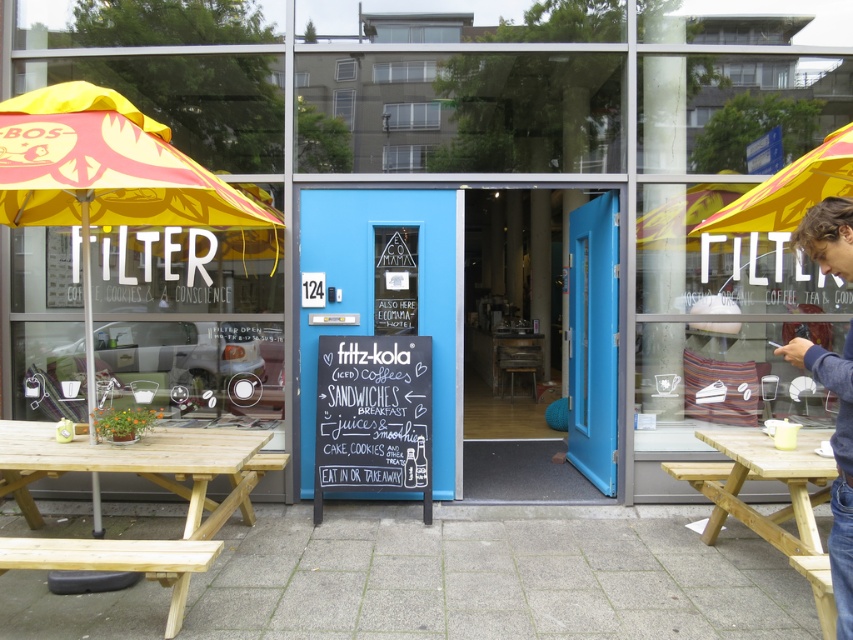
Question: Does yellow fabric umbrella at left come in front of natural wood picnic table at lower left?

Choices:
 (A) no
 (B) yes

Answer: (A)

Question: Among these objects, which one is farthest from the camera?

Choices:
 (A) black chalkboard sign at center
 (B) natural wood picnic table at right

Answer: (A)

Question: Which of the following is the farthest from the observer?

Choices:
 (A) black chalkboard sign at center
 (B) natural wood picnic table at right
 (C) yellow fabric umbrella at left
 (D) brown hair at right

Answer: (A)

Question: Which point is farther to the camera?

Choices:
 (A) (158, 195)
 (B) (834, 353)

Answer: (A)

Question: Is natural wood picnic table at right thinner than brown hair at right?

Choices:
 (A) no
 (B) yes

Answer: (A)

Question: Does natural wood picnic table at right appear on the right side of brown hair at right?

Choices:
 (A) yes
 (B) no

Answer: (A)